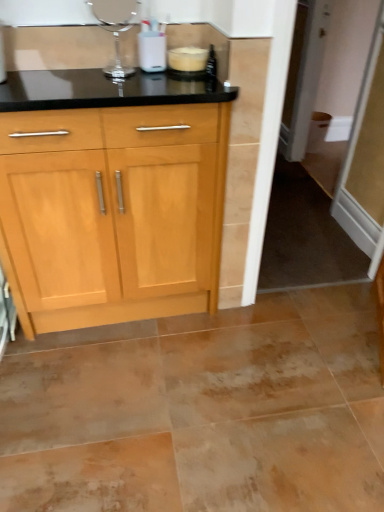
Question: Considering the relative sizes of white plastic container at upper center, arranged as the second appliance when viewed from the left, and transparent glass screen door at right in the image provided, is white plastic container at upper center, arranged as the second appliance when viewed from the left, wider than transparent glass screen door at right?

Choices:
 (A) no
 (B) yes

Answer: (A)

Question: Is white plastic container at upper center, the first appliance from the right, facing away from transparent glass screen door at right?

Choices:
 (A) no
 (B) yes

Answer: (A)

Question: Considering the relative positions of white plastic container at upper center, arranged as the second appliance when viewed from the left, and transparent glass screen door at right in the image provided, is white plastic container at upper center, arranged as the second appliance when viewed from the left, in front of transparent glass screen door at right?

Choices:
 (A) no
 (B) yes

Answer: (B)

Question: Is white plastic container at upper center, the first appliance from the right, at the left side of transparent glass screen door at right?

Choices:
 (A) yes
 (B) no

Answer: (A)

Question: Does white plastic container at upper center, arranged as the second appliance when viewed from the left, come behind transparent glass screen door at right?

Choices:
 (A) no
 (B) yes

Answer: (A)

Question: From a real-world perspective, is clear glass vase at upper center, the 2th appliance in the right-to-left sequence, above or below white plastic container at upper center, the first appliance from the right?

Choices:
 (A) above
 (B) below

Answer: (A)

Question: In terms of height, does clear glass vase at upper center, marked as the 1th appliance in a left-to-right arrangement, look taller or shorter compared to white plastic container at upper center, the first appliance from the right?

Choices:
 (A) short
 (B) tall

Answer: (B)

Question: Considering their positions, is clear glass vase at upper center, marked as the 1th appliance in a left-to-right arrangement, located in front of or behind white plastic container at upper center, arranged as the second appliance when viewed from the left?

Choices:
 (A) front
 (B) behind

Answer: (A)

Question: In terms of width, does clear glass vase at upper center, the 2th appliance in the right-to-left sequence, look wider or thinner when compared to white plastic container at upper center, the first appliance from the right?

Choices:
 (A) thin
 (B) wide

Answer: (A)

Question: Looking at their shapes, would you say white plastic container at upper center, arranged as the second appliance when viewed from the left, is wider or thinner than clear glass vase at upper center, the 2th appliance in the right-to-left sequence?

Choices:
 (A) wide
 (B) thin

Answer: (A)

Question: Would you say white plastic container at upper center, arranged as the second appliance when viewed from the left, is inside or outside clear glass vase at upper center, marked as the 1th appliance in a left-to-right arrangement?

Choices:
 (A) inside
 (B) outside

Answer: (B)

Question: Visually, is white plastic container at upper center, arranged as the second appliance when viewed from the left, positioned to the left or to the right of clear glass vase at upper center, the 2th appliance in the right-to-left sequence?

Choices:
 (A) right
 (B) left

Answer: (A)

Question: From the image's perspective, relative to clear glass vase at upper center, marked as the 1th appliance in a left-to-right arrangement, is white plastic container at upper center, the first appliance from the right, above or below?

Choices:
 (A) above
 (B) below

Answer: (B)

Question: Is transparent glass screen door at right situated inside clear glass vase at upper center, the 2th appliance in the right-to-left sequence, or outside?

Choices:
 (A) inside
 (B) outside

Answer: (B)

Question: From a real-world perspective, relative to clear glass vase at upper center, the 2th appliance in the right-to-left sequence, is transparent glass screen door at right vertically above or below?

Choices:
 (A) above
 (B) below

Answer: (B)